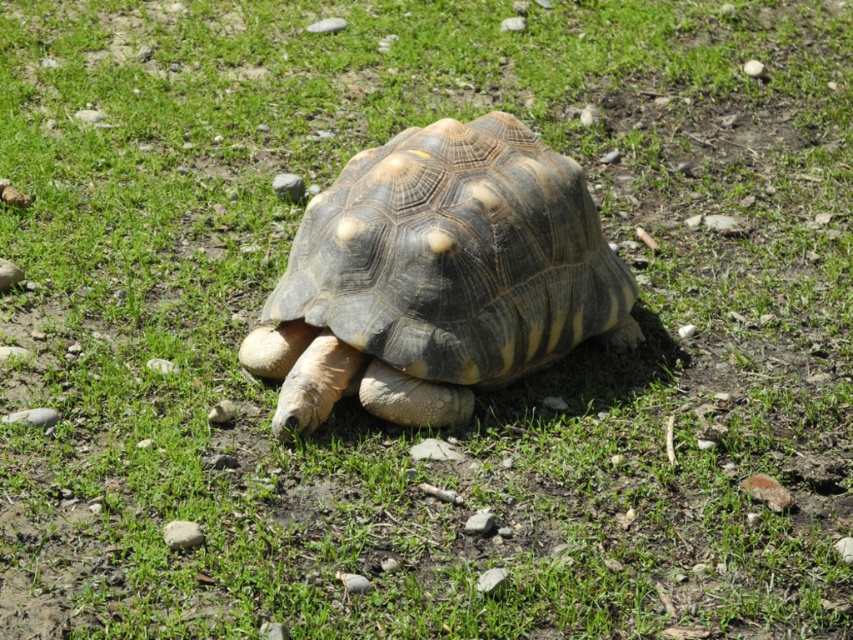
Is point (367, 358) more distant than point (7, 413)?

Yes.

Looking at this image, who is positioned more to the left, leathery brown tortoise at center or gray gravel at lower left?

Positioned to the left is gray gravel at lower left.

Who is more forward, (440, 227) or (47, 426)?

Point (47, 426) is in front.

What are the coordinates of `leathery brown tortoise at center` in the screenshot? It's located at (438, 276).

What do you see at coordinates (288, 186) in the screenshot? I see `gray rock at center` at bounding box center [288, 186].

Is gray rock at center further to camera compared to gray gravel stone at lower left?

Yes, it is.

Describe the element at coordinates (288, 186) in the screenshot. I see `gray rock at center` at that location.

The image size is (853, 640). What are the coordinates of `gray rock at center` in the screenshot? It's located at (288, 186).

Between smooth gray rock at lower left and gray rock at center, which one is positioned higher?

gray rock at center

Is point (172, 529) closer to camera compared to point (302, 188)?

That is True.

The width and height of the screenshot is (853, 640). I want to click on smooth gray rock at lower left, so click(183, 532).